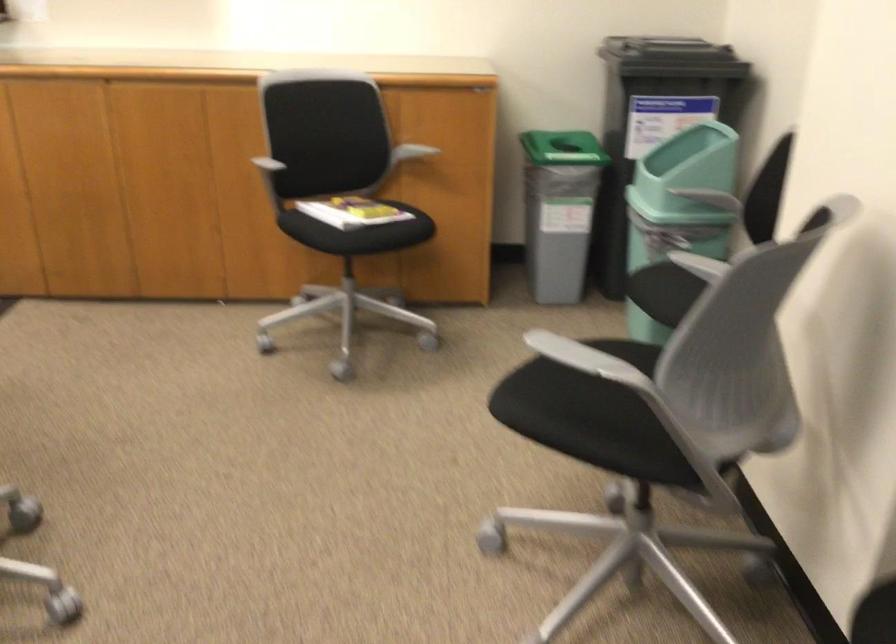
This screenshot has height=644, width=896. What do you see at coordinates (355, 212) in the screenshot?
I see `the book on chair` at bounding box center [355, 212].